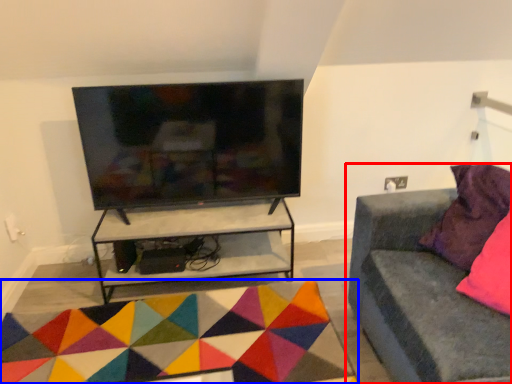
Question: Which object appears closest to the camera in this image, studio couch (highlighted by a red box) or mat (highlighted by a blue box)?

Choices:
 (A) studio couch
 (B) mat

Answer: (A)